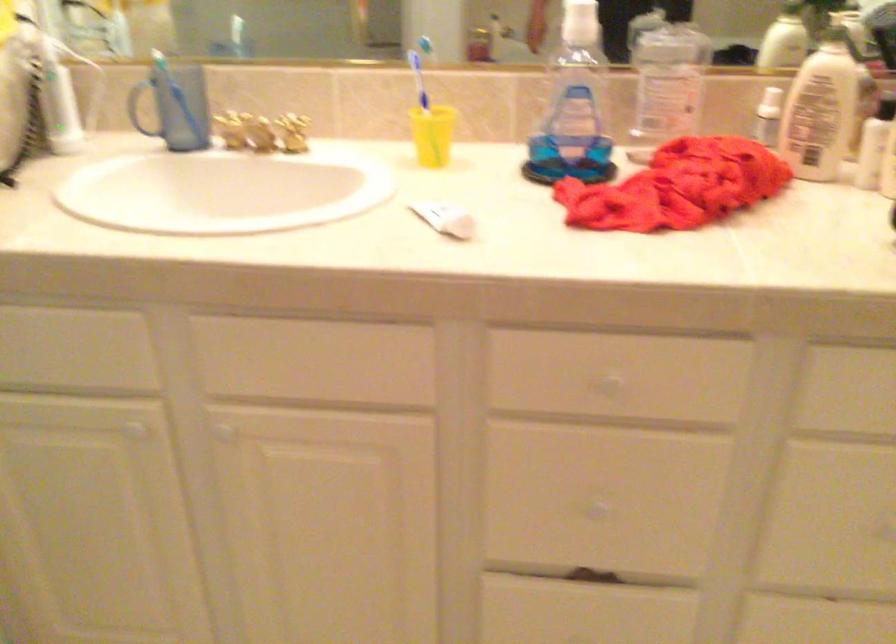
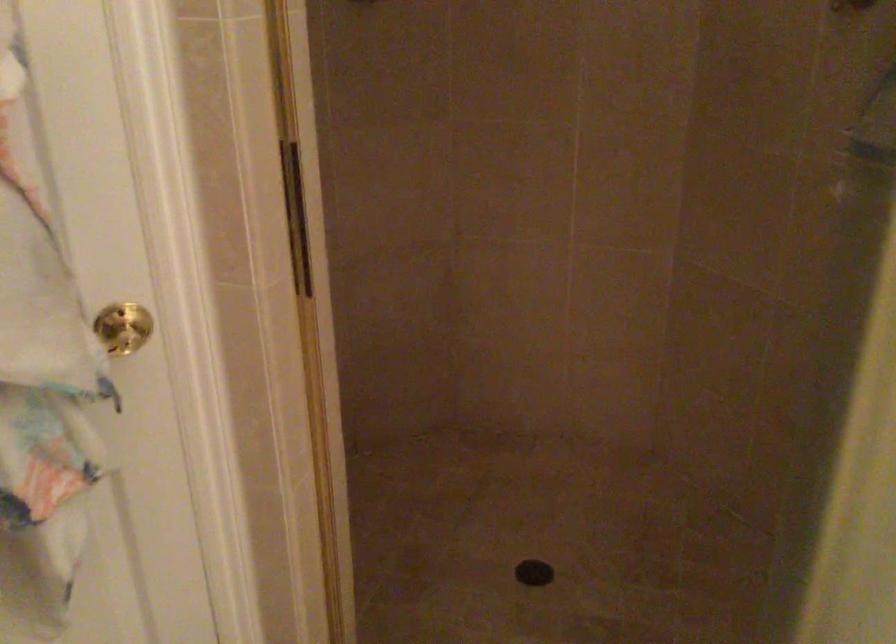
Question: The camera is either moving clockwise (left) or counter-clockwise (right) around the object. The first image is from the beginning of the video and the second image is from the end. Is the camera moving left or right when shooting the video?

Choices:
 (A) Left
 (B) Right

Answer: (B)